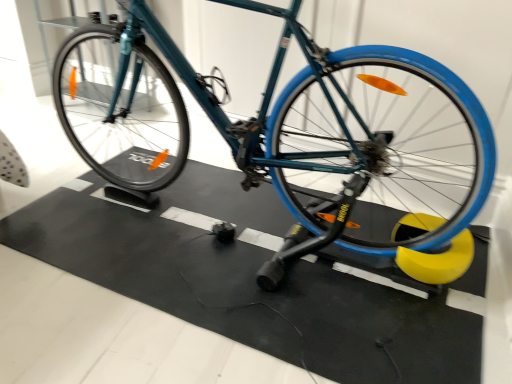
What is the approximate width of teal metallic bicycle at center?

teal metallic bicycle at center is 1.75 meters in width.

In order to face teal metallic bicycle at center, should I rotate leftwards or rightwards?

You should rotate left by 4.615 degrees.

The image size is (512, 384). What do you see at coordinates (290, 130) in the screenshot? I see `teal metallic bicycle at center` at bounding box center [290, 130].

Identify the location of teal metallic bicycle at center. (290, 130).

This screenshot has height=384, width=512. Identify the location of teal metallic bicycle at center. (290, 130).